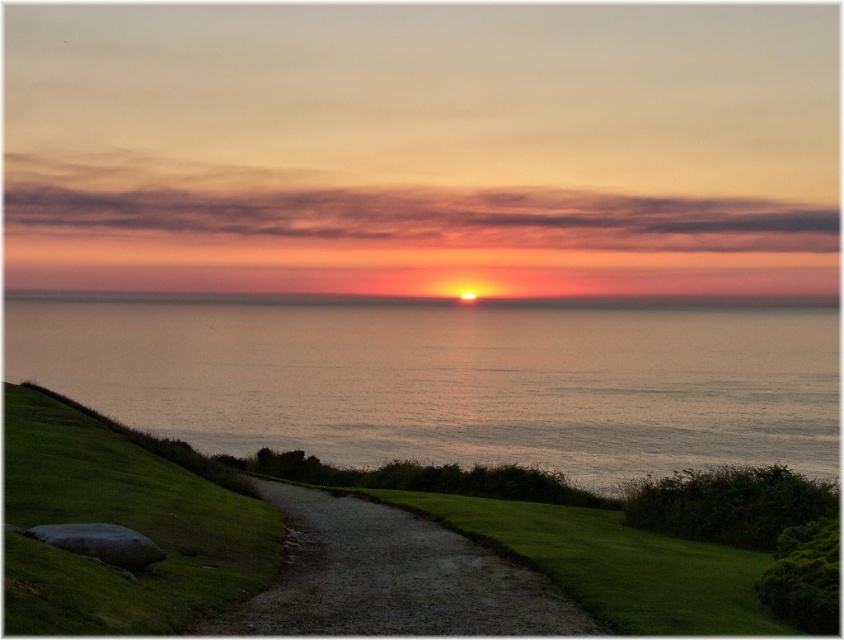
Question: Which is nearer to the silvery water at center?

Choices:
 (A) dirt/gravel path at center
 (B) green grassy at lower left

Answer: (A)

Question: Is the position of silvery water at center less distant than that of dirt/gravel path at center?

Choices:
 (A) yes
 (B) no

Answer: (B)

Question: Is green grassy at lower left thinner than dirt/gravel path at center?

Choices:
 (A) no
 (B) yes

Answer: (A)

Question: Considering the real-world distances, which object is farthest from the green grassy at lower left?

Choices:
 (A) dirt/gravel path at center
 (B) silvery water at center

Answer: (B)

Question: Estimate the real-world distances between objects in this image. Which object is farther from the silvery water at center?

Choices:
 (A) green grassy at lower left
 (B) dirt/gravel path at center

Answer: (A)

Question: Where is silvery water at center located in relation to green grassy at lower left in the image?

Choices:
 (A) right
 (B) left

Answer: (B)